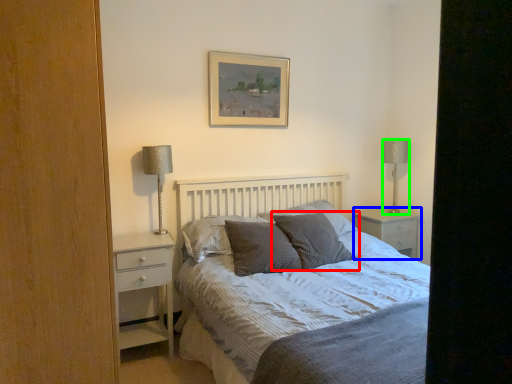
Question: Estimate the real-world distances between objects in this image. Which object is closer to pillow (highlighted by a red box), nightstand (highlighted by a blue box) or table lamp (highlighted by a green box)?

Choices:
 (A) nightstand
 (B) table lamp

Answer: (A)